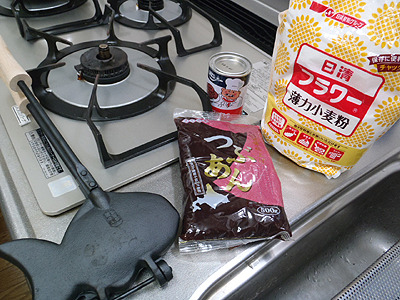
Find the location of `middle of burner`. middle of burner is located at coordinates (101, 63).